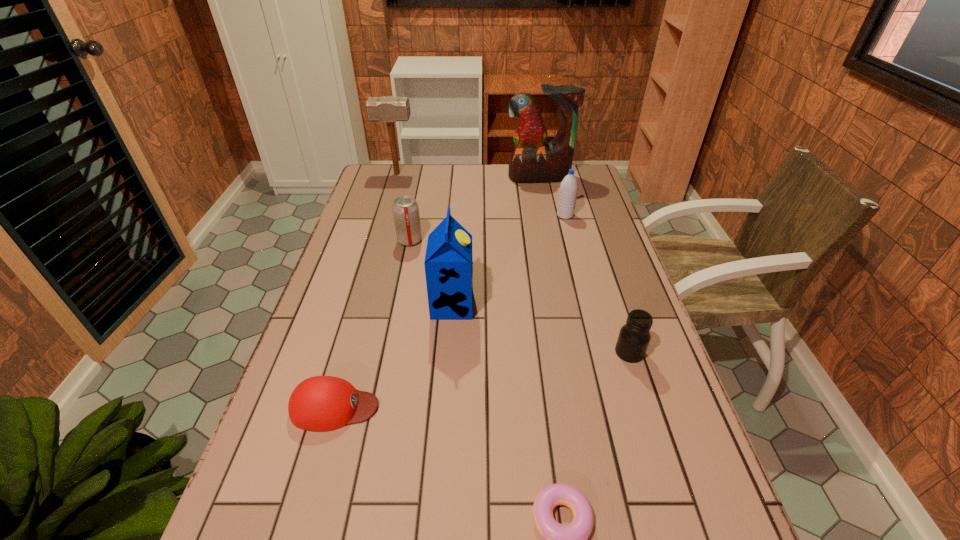
You are a GUI agent. You are given a task and a screenshot of the screen. Output one action in this format:
    pyautogui.click(x=<x>, y=<y>)
    Task: Click on the vacant space in between the fifth farthest object and the baseball cap
    
    Given the screenshot: What is the action you would take?
    pyautogui.click(x=394, y=356)

Locate an element on the screen. object that is the seventh closest to the fourth shortest object is located at coordinates (572, 539).

Where is `object that is the fifth closest to the second shortest object`? The width and height of the screenshot is (960, 540). object that is the fifth closest to the second shortest object is located at coordinates (568, 191).

This screenshot has height=540, width=960. I want to click on vacant space that satisfies the following two spatial constraints: 1. on the striking face of the mallet; 2. on the left side of the sixth farthest object, so click(x=345, y=352).

Image resolution: width=960 pixels, height=540 pixels. Identify the location of vacant area in the image that satisfies the following two spatial constraints: 1. at the face of the tallest object; 2. with the cap open on the fifth farthest object. (565, 305).

Locate an element on the screen. The width and height of the screenshot is (960, 540). vacant space that satisfies the following two spatial constraints: 1. with the cap open on the carton; 2. on the right side of the jar is located at coordinates (449, 352).

The width and height of the screenshot is (960, 540). Identify the location of vacant region that satisfies the following two spatial constraints: 1. on the front side of the sixth farthest object; 2. on the front-facing side of the second shortest object. (647, 407).

Where is `free space that satisfies the following two spatial constraints: 1. with the cap open on the fifth farthest object; 2. on the right side of the third shortest object`? The width and height of the screenshot is (960, 540). free space that satisfies the following two spatial constraints: 1. with the cap open on the fifth farthest object; 2. on the right side of the third shortest object is located at coordinates (449, 352).

Where is `free space in the image that satisfies the following two spatial constraints: 1. at the face of the third nearest object; 2. on the left side of the parrot`? The height and width of the screenshot is (540, 960). free space in the image that satisfies the following two spatial constraints: 1. at the face of the third nearest object; 2. on the left side of the parrot is located at coordinates (576, 352).